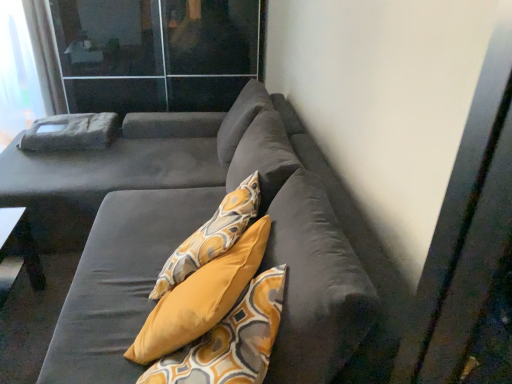
Question: Should I look upward or downward to see suede gray couch at center?

Choices:
 (A) up
 (B) down

Answer: (B)

Question: From the image's perspective, is transparent glass screen door at upper left below suede gray couch at center?

Choices:
 (A) no
 (B) yes

Answer: (A)

Question: Is transparent glass screen door at upper left shorter than suede gray couch at center?

Choices:
 (A) yes
 (B) no

Answer: (B)

Question: Is transparent glass screen door at upper left located outside suede gray couch at center?

Choices:
 (A) yes
 (B) no

Answer: (A)

Question: From the image's perspective, does transparent glass screen door at upper left appear higher than suede gray couch at center?

Choices:
 (A) no
 (B) yes

Answer: (B)

Question: Is suede gray couch at center surrounded by transparent glass screen door at upper left?

Choices:
 (A) yes
 (B) no

Answer: (B)

Question: Is transparent glass screen door at upper left taller than suede gray couch at center?

Choices:
 (A) no
 (B) yes

Answer: (B)

Question: Does suede gray couch at center have a larger size compared to white sheer curtain at upper left?

Choices:
 (A) yes
 (B) no

Answer: (A)

Question: From a real-world perspective, is suede gray couch at center positioned over white sheer curtain at upper left based on gravity?

Choices:
 (A) no
 (B) yes

Answer: (A)

Question: From the image's perspective, does suede gray couch at center appear lower than white sheer curtain at upper left?

Choices:
 (A) no
 (B) yes

Answer: (B)

Question: From the image's perspective, is suede gray couch at center on top of white sheer curtain at upper left?

Choices:
 (A) no
 (B) yes

Answer: (A)

Question: Is suede gray couch at center positioned behind white sheer curtain at upper left?

Choices:
 (A) no
 (B) yes

Answer: (A)

Question: Does suede gray couch at center have a greater width compared to white sheer curtain at upper left?

Choices:
 (A) yes
 (B) no

Answer: (A)

Question: Is white sheer curtain at upper left smaller than suede gray couch at center?

Choices:
 (A) yes
 (B) no

Answer: (A)